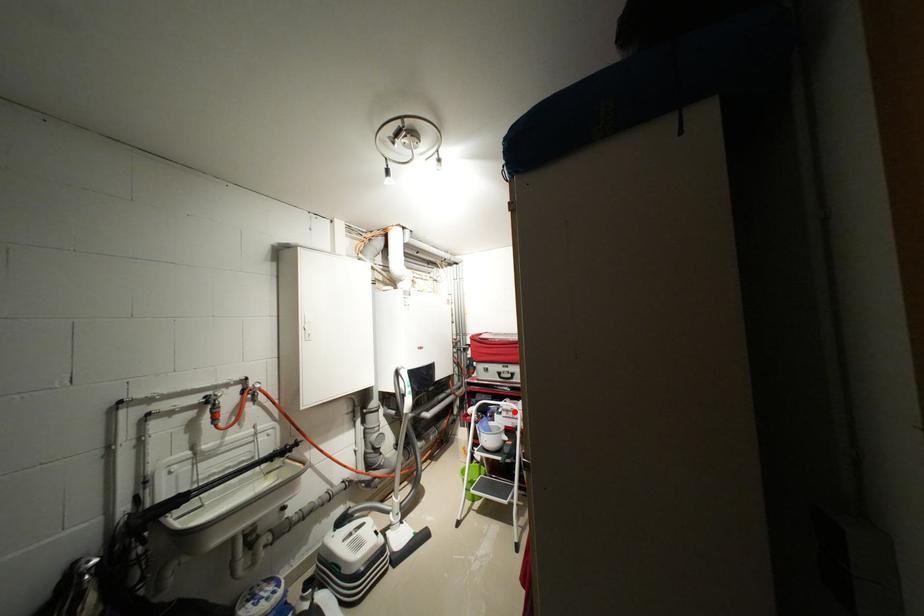
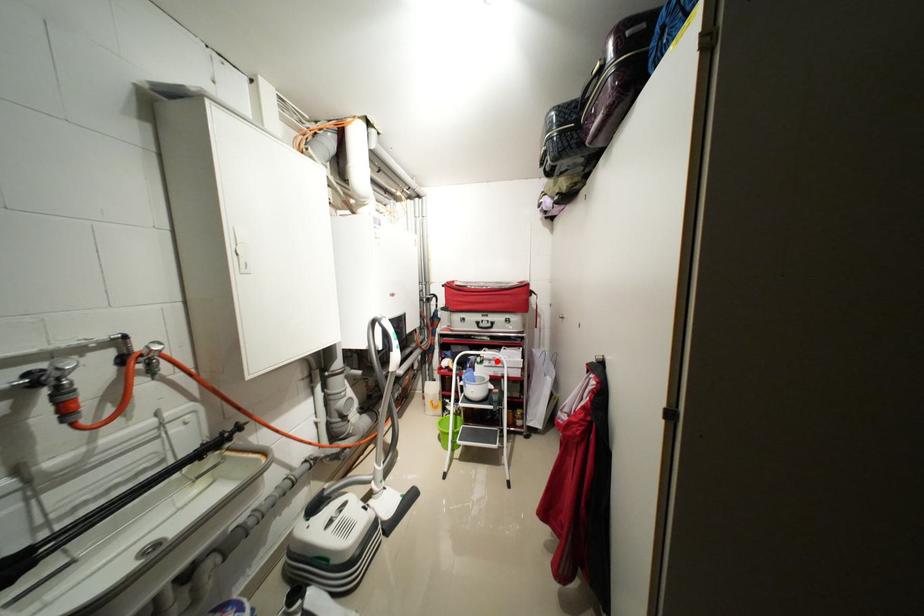
I am providing you with two images of the same scene from different viewpoints. A red point is marked on the first image and another point is marked on the second image. Is the red point in image1 aligned with the point shown in image2?

Yes